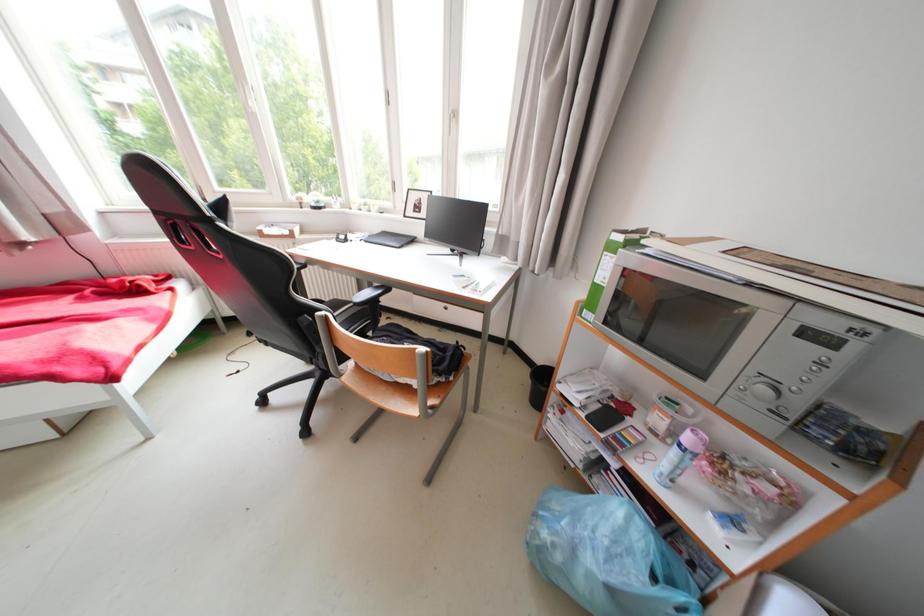
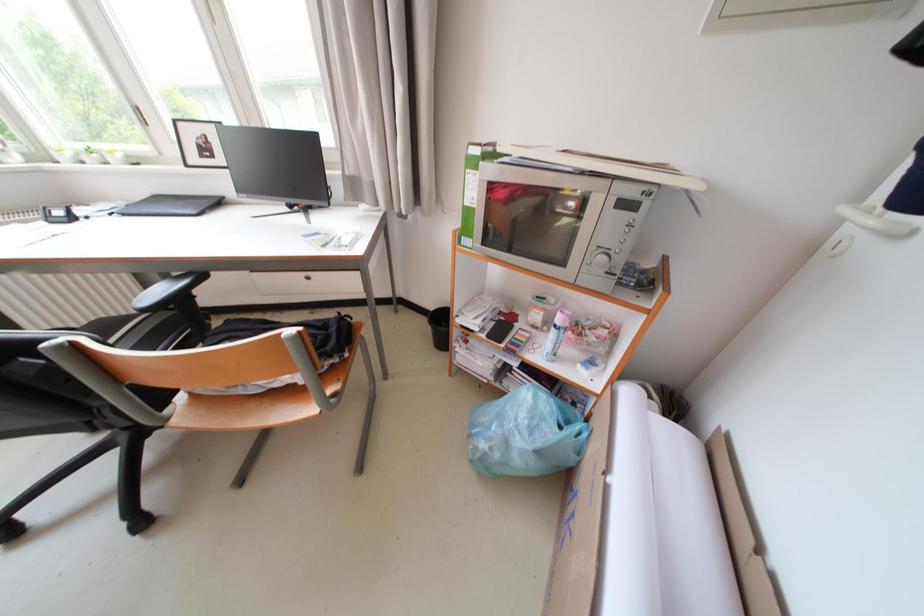
Question: The camera is either moving clockwise (left) or counter-clockwise (right) around the object. The first image is from the beginning of the video and the second image is from the end. Is the camera moving left or right when shooting the video?

Choices:
 (A) Left
 (B) Right

Answer: (A)